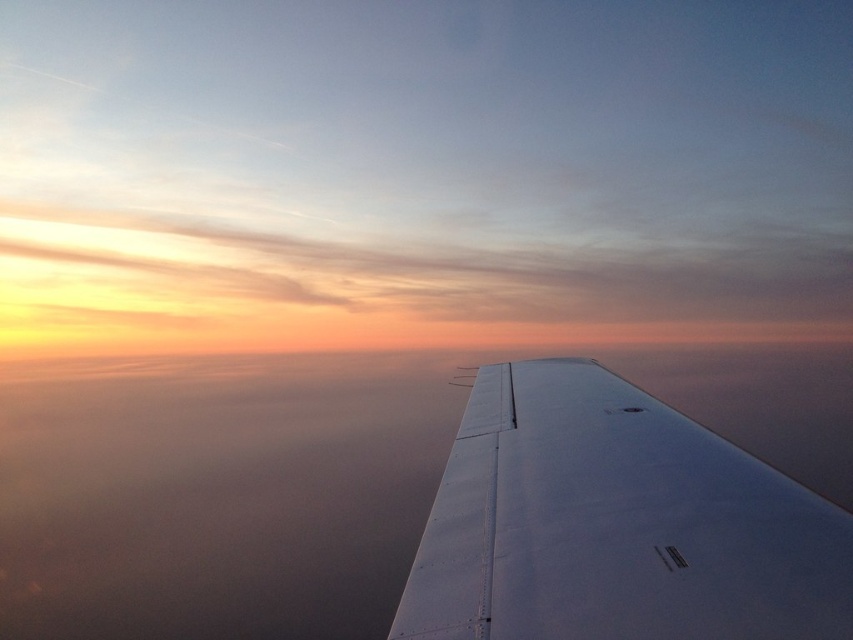
Question: Which object appears closest to the camera in this image?

Choices:
 (A) white matte wing at center
 (B) transparent glass airplane window at lower right
 (C) transparent glass airplane window at center

Answer: (A)

Question: Can you confirm if white matte wing at center is positioned to the left of transparent glass airplane window at lower right?

Choices:
 (A) yes
 (B) no

Answer: (B)

Question: Among these objects, which one is farthest from the camera?

Choices:
 (A) transparent glass airplane window at lower right
 (B) white matte wing at center
 (C) transparent glass airplane window at center

Answer: (C)

Question: Does transparent glass airplane window at lower right appear on the left side of transparent glass airplane window at center?

Choices:
 (A) yes
 (B) no

Answer: (A)

Question: Which of these objects is positioned farthest from the white matte wing at center?

Choices:
 (A) transparent glass airplane window at lower right
 (B) transparent glass airplane window at center

Answer: (A)

Question: Can you confirm if transparent glass airplane window at lower right is wider than transparent glass airplane window at center?

Choices:
 (A) yes
 (B) no

Answer: (B)